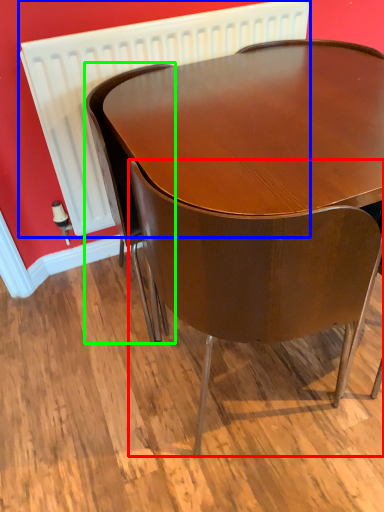
Question: Which is nearer to the chair (highlighted by a red box)? radiator (highlighted by a blue box) or chair (highlighted by a green box).

Choices:
 (A) radiator
 (B) chair

Answer: (B)